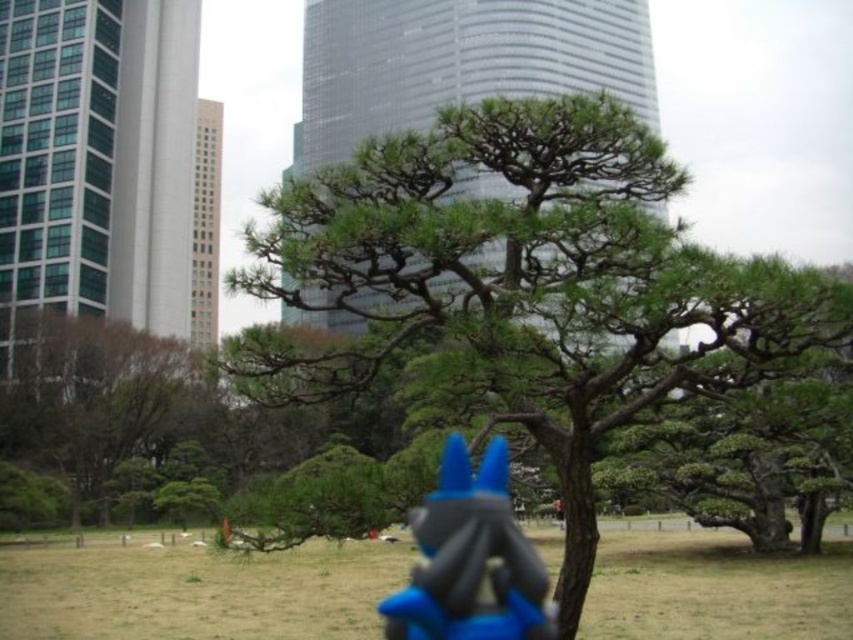
Looking at this image, does green leafy tree at left have a larger size compared to blue plastic toy at center?

Yes.

Is green leafy tree at left wider than blue plastic toy at center?

Yes.

At what (x,y) coordinates should I click in order to perform the action: click on green leafy tree at left. Please return your answer as a coordinate pair (x, y). The height and width of the screenshot is (640, 853). Looking at the image, I should click on (91, 397).

Is green needle-like at center taller than green leafy tree at left?

In fact, green needle-like at center may be shorter than green leafy tree at left.

Looking at this image, can you confirm if green needle-like at center is wider than green leafy tree at left?

Incorrect, green needle-like at center's width does not surpass green leafy tree at left's.

The image size is (853, 640). I want to click on green needle-like at center, so click(521, 288).

Is green needle-like at center smaller than blue plastic toy at center?

No.

Between point (631, 316) and point (399, 618), which one is positioned in front?

Positioned in front is point (399, 618).

Is point (572, 230) positioned in front of point (463, 483)?

No, it is behind (463, 483).

This screenshot has height=640, width=853. I want to click on green needle-like at center, so click(521, 288).